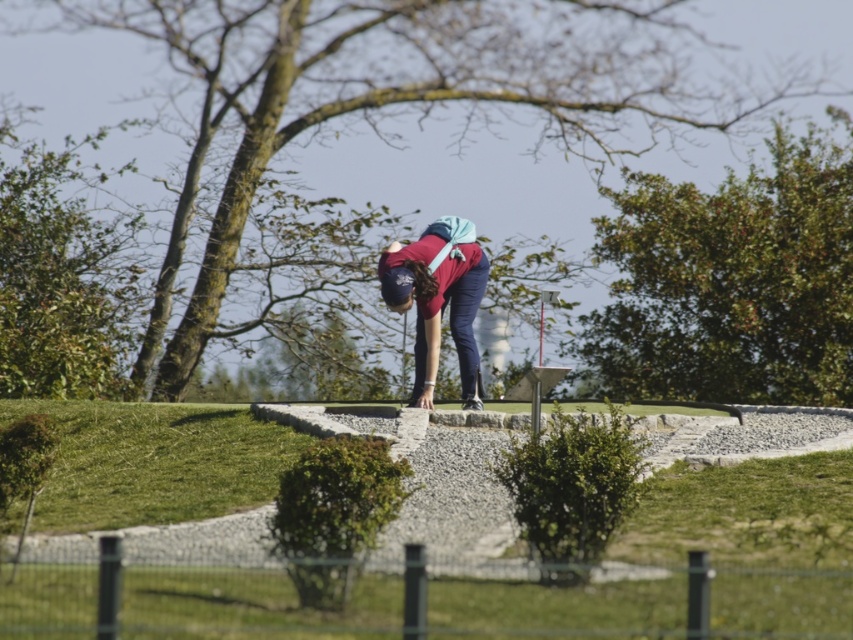
Question: Which point appears closest to the camera in this image?

Choices:
 (A) (451, 252)
 (B) (137, 564)

Answer: (B)

Question: Does smooth gravel path at center appear on the right side of matte red shirt at center?

Choices:
 (A) yes
 (B) no

Answer: (A)

Question: Does smooth gravel path at center appear on the left side of matte red shirt at center?

Choices:
 (A) no
 (B) yes

Answer: (A)

Question: Which object appears closest to the camera in this image?

Choices:
 (A) smooth gravel path at center
 (B) matte red shirt at center

Answer: (A)

Question: Can you confirm if smooth gravel path at center is positioned above matte red shirt at center?

Choices:
 (A) no
 (B) yes

Answer: (A)